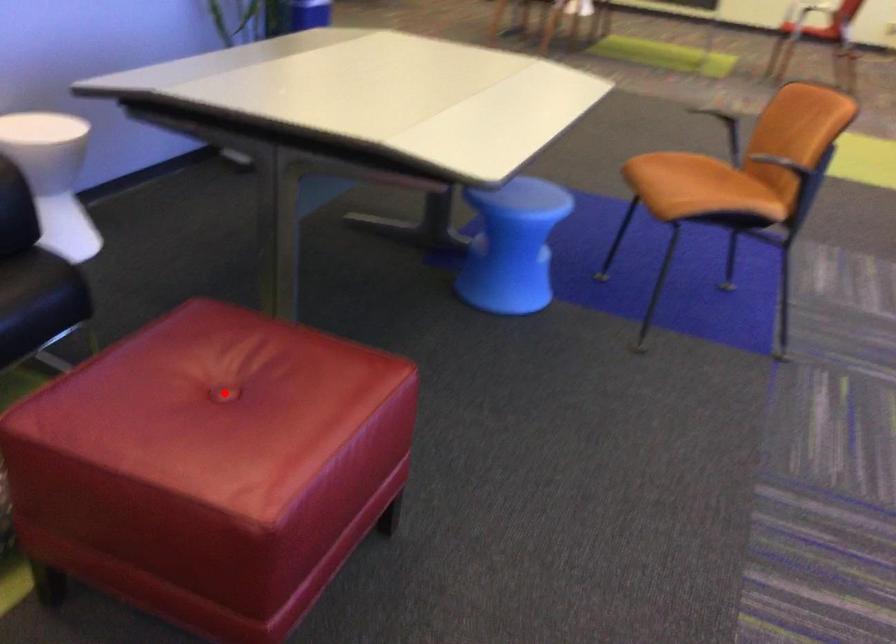
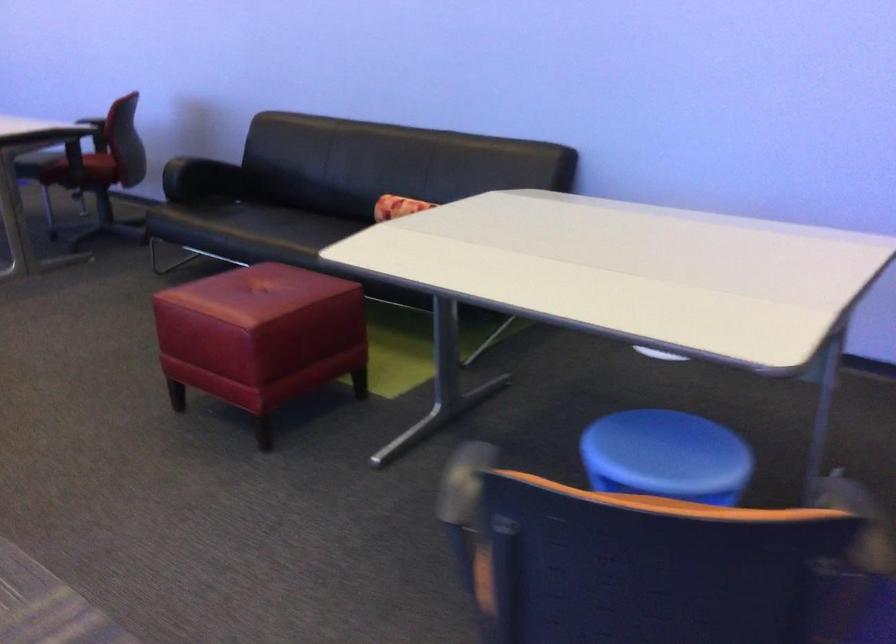
Find the pixel in the second image that matches the highlighted location in the first image.

(260, 292)